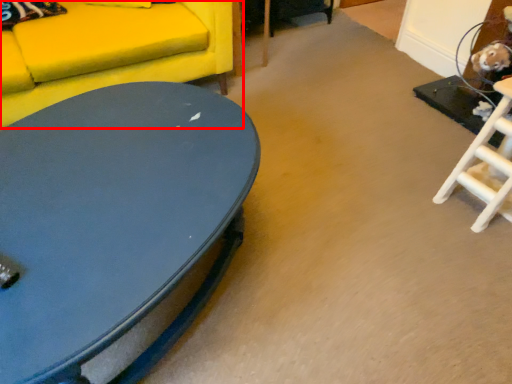
Question: From the image's perspective, what is the correct spatial positioning of studio couch (annotated by the red box) in reference to coffee table?

Choices:
 (A) above
 (B) below

Answer: (A)